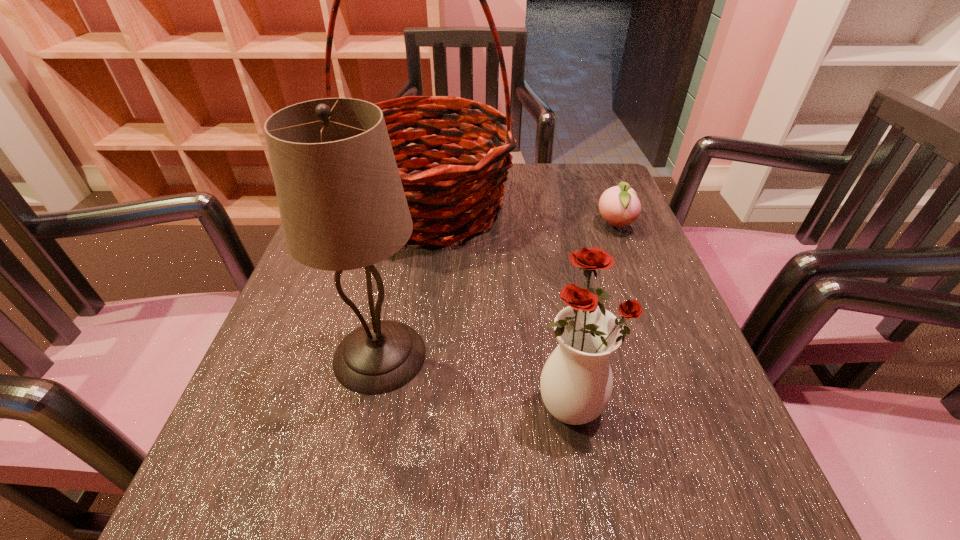
Image resolution: width=960 pixels, height=540 pixels. In order to click on the tallest object in this screenshot , I will do `click(453, 186)`.

The width and height of the screenshot is (960, 540). What are the coordinates of `lampshade` in the screenshot? It's located at (342, 205).

Identify the location of vase. (576, 383).

Find the location of a particular element. This screenshot has height=540, width=960. peach is located at coordinates (619, 206).

What are the coordinates of `the rightmost object` in the screenshot? It's located at (619, 206).

Image resolution: width=960 pixels, height=540 pixels. Find the location of `free space located 0.380m on the front of the basket`. free space located 0.380m on the front of the basket is located at coordinates (396, 426).

Find the location of a particular element. free spot located on the front-facing side of the second tallest object is located at coordinates (612, 355).

At what (x,y) coordinates should I click in order to perform the action: click on free location located 0.320m on the left of the second shortest object. Please return your answer as a coordinate pair (x, y). The width and height of the screenshot is (960, 540). Looking at the image, I should click on (324, 401).

The width and height of the screenshot is (960, 540). I want to click on vacant space located on the back of the rightmost object, so 594,174.

You are a GUI agent. You are given a task and a screenshot of the screen. Output one action in this format:
    pyautogui.click(x=<x>, y=<y>)
    Task: Click on the object at the far edge
    
    Given the screenshot: What is the action you would take?
    pyautogui.click(x=453, y=186)